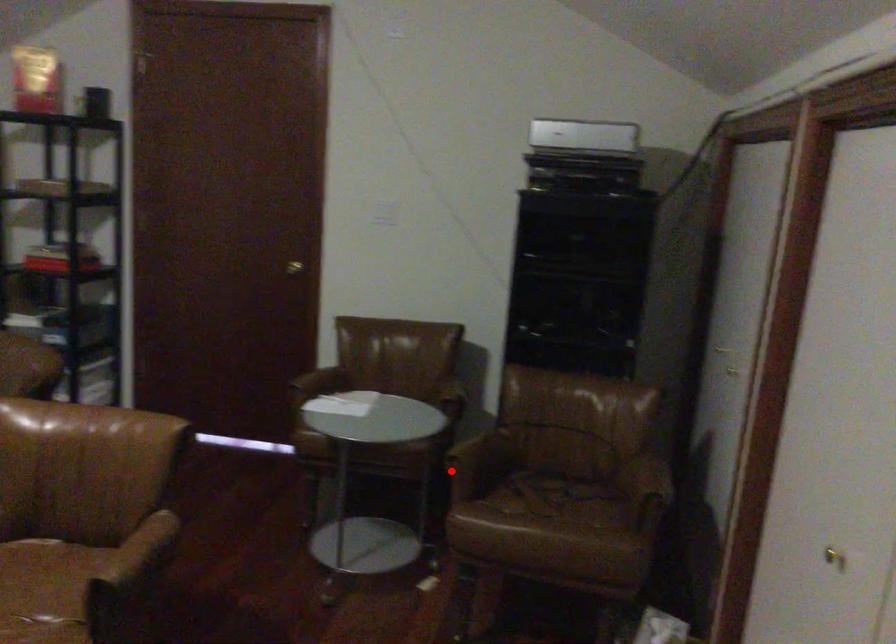
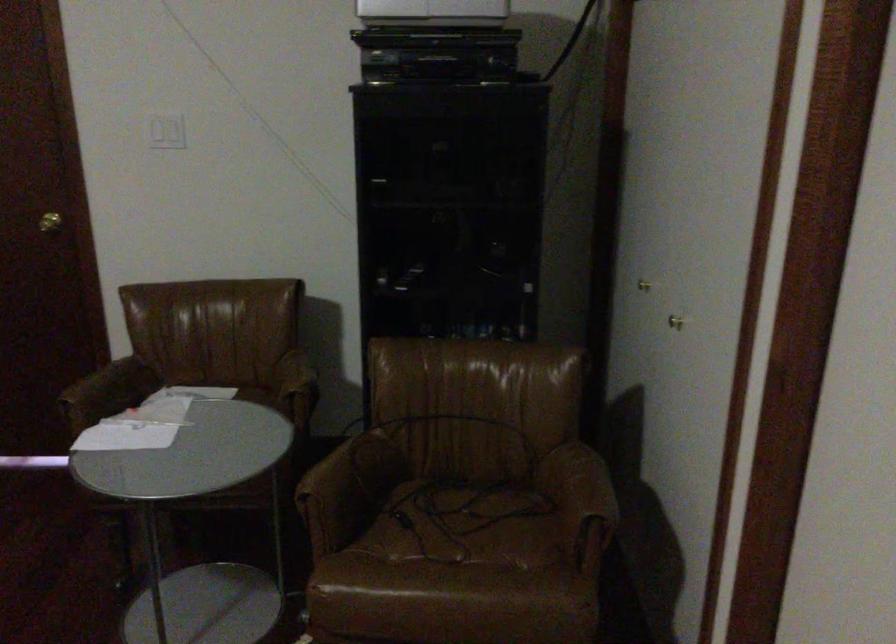
Question: A red point is marked in image1. In image2, is the corresponding 3D point closer to the camera or farther? Reply with the corresponding letter.

Choices:
 (A) The corresponding 3D point is closer.
 (B) The corresponding 3D point is farther.

Answer: (A)